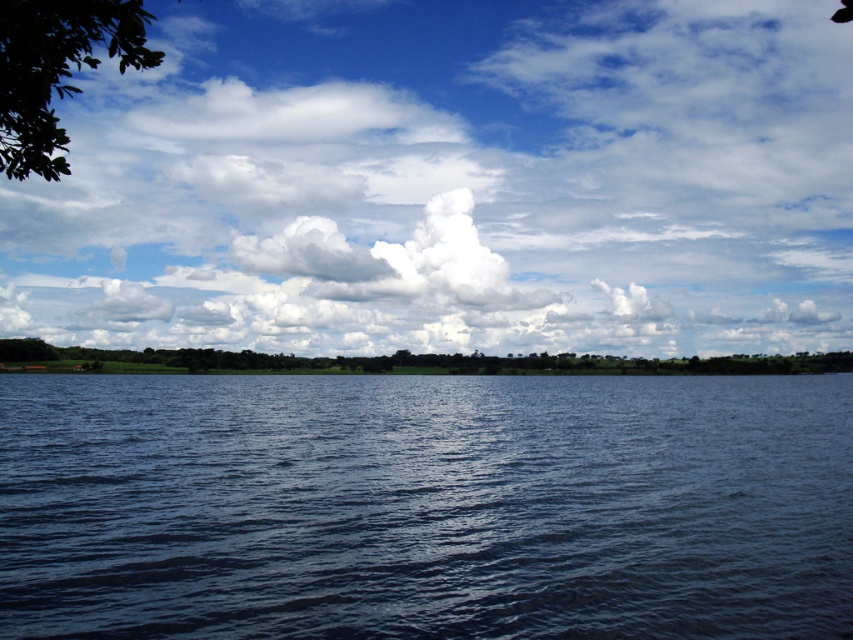
You are standing at the edge of the landscape and want to determine which object occupies more space in the scene. Based on the image, which is larger between the dark blue water at center and the green leafy tree at center?

The green leafy tree at center is larger than the dark blue water at center according to the description.

You are standing at the edge of the water and see the green leafy tree at upper left and the green leafy tree at center. Which tree is closer to the water?

The green leafy tree at center is closer to the water because the green leafy tree at upper left is positioned over it, meaning it is farther away.